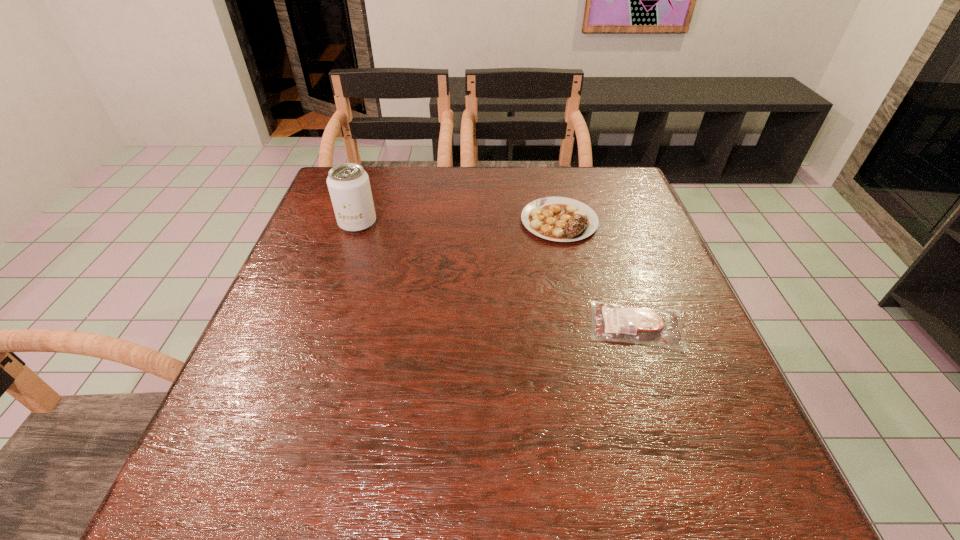
You are a GUI agent. You are given a task and a screenshot of the screen. Output one action in this format:
    pyautogui.click(x=<x>, y=<y>)
    Task: Click on the free spot between the shortest object and the tallest object
    
    Given the screenshot: What is the action you would take?
    pyautogui.click(x=497, y=274)

In order to click on free space that is in between the second shortest object and the tallest object in this screenshot , I will do `click(458, 222)`.

At what (x,y) coordinates should I click in order to perform the action: click on vacant region between the soda can and the nearer steak. Please return your answer as a coordinate pair (x, y). Looking at the image, I should click on (497, 274).

You are a GUI agent. You are given a task and a screenshot of the screen. Output one action in this format:
    pyautogui.click(x=<x>, y=<y>)
    Task: Click on the vacant point located between the tallest object and the nearest object
    
    Given the screenshot: What is the action you would take?
    pyautogui.click(x=497, y=274)

Locate an element on the screen. This screenshot has height=540, width=960. vacant space in between the second tallest object and the nearest object is located at coordinates (598, 273).

Identify the location of free space between the nearer steak and the leftmost object. pos(497,274).

I want to click on free space that is in between the soda can and the second tallest object, so click(458, 222).

The height and width of the screenshot is (540, 960). I want to click on vacant region between the shorter steak and the taller steak, so click(598, 273).

You are a GUI agent. You are given a task and a screenshot of the screen. Output one action in this format:
    pyautogui.click(x=<x>, y=<y>)
    Task: Click on the closest object to the second shortest object
    This screenshot has height=540, width=960.
    Given the screenshot: What is the action you would take?
    pyautogui.click(x=640, y=325)

Identify the location of object that is the nearest to the nearest object. (561, 219).